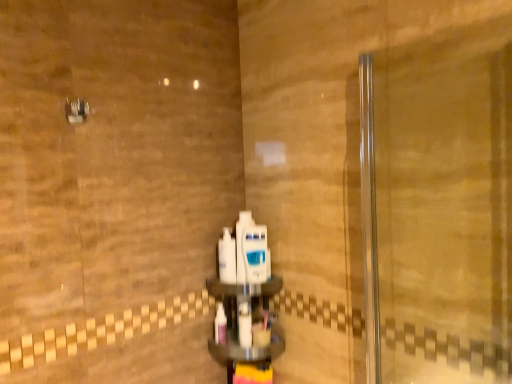
Question: Is white glossy mouthwash at center, arranged as the 3th mouthwash when ordered from the bottom, positioned with its back to white plastic mouthwash at center, which is counted as the 1th mouthwash, starting from the bottom?

Choices:
 (A) yes
 (B) no

Answer: (B)

Question: Considering the relative sizes of white glossy mouthwash at center, positioned as the second mouthwash in top-to-bottom order, and white plastic mouthwash at center, positioned as the 4th mouthwash in top-to-bottom order, in the image provided, is white glossy mouthwash at center, positioned as the second mouthwash in top-to-bottom order, wider than white plastic mouthwash at center, positioned as the 4th mouthwash in top-to-bottom order,?

Choices:
 (A) no
 (B) yes

Answer: (B)

Question: From the image's perspective, is white glossy mouthwash at center, arranged as the 3th mouthwash when ordered from the bottom, located above white plastic mouthwash at center, positioned as the 4th mouthwash in top-to-bottom order?

Choices:
 (A) no
 (B) yes

Answer: (B)

Question: Can you confirm if white glossy mouthwash at center, positioned as the second mouthwash in top-to-bottom order, is shorter than white plastic mouthwash at center, which is counted as the 1th mouthwash, starting from the bottom?

Choices:
 (A) yes
 (B) no

Answer: (B)

Question: Is white glossy mouthwash at center, arranged as the 3th mouthwash when ordered from the bottom, positioned far away from white plastic mouthwash at center, which is counted as the 1th mouthwash, starting from the bottom?

Choices:
 (A) no
 (B) yes

Answer: (A)

Question: In terms of height, does white glossy mouthwash at center, arranged as the 2th mouthwash when ordered from the bottom, look taller or shorter compared to metallic silver showerhead at upper left?

Choices:
 (A) short
 (B) tall

Answer: (B)

Question: Is white glossy mouthwash at center, the third mouthwash in the top-to-bottom sequence, to the left or to the right of metallic silver showerhead at upper left in the image?

Choices:
 (A) right
 (B) left

Answer: (A)

Question: Is white glossy mouthwash at center, the third mouthwash in the top-to-bottom sequence, situated inside metallic silver showerhead at upper left or outside?

Choices:
 (A) outside
 (B) inside

Answer: (A)

Question: Considering their positions, is white glossy mouthwash at center, arranged as the 2th mouthwash when ordered from the bottom, located in front of or behind metallic silver showerhead at upper left?

Choices:
 (A) front
 (B) behind

Answer: (B)

Question: From a real-world perspective, relative to white plastic mouthwash at center, positioned as the 4th mouthwash in top-to-bottom order, is white glossy mouthwash at center, arranged as the 2th mouthwash when ordered from the bottom, vertically above or below?

Choices:
 (A) above
 (B) below

Answer: (A)

Question: Is white glossy mouthwash at center, the third mouthwash in the top-to-bottom sequence, bigger or smaller than white plastic mouthwash at center, which is counted as the 1th mouthwash, starting from the bottom?

Choices:
 (A) big
 (B) small

Answer: (A)

Question: From the image's perspective, is white glossy mouthwash at center, the third mouthwash in the top-to-bottom sequence, above or below white plastic mouthwash at center, which is counted as the 1th mouthwash, starting from the bottom?

Choices:
 (A) below
 (B) above

Answer: (B)

Question: Is white glossy mouthwash at center, arranged as the 2th mouthwash when ordered from the bottom, in front of or behind white plastic mouthwash at center, positioned as the 4th mouthwash in top-to-bottom order, in the image?

Choices:
 (A) behind
 (B) front

Answer: (B)

Question: Is white glossy mouthwash at center, positioned as the second mouthwash in top-to-bottom order, situated inside white glossy mouthwash at center, which is the fourth mouthwash from bottom to top, or outside?

Choices:
 (A) inside
 (B) outside

Answer: (B)

Question: Relative to white glossy mouthwash at center, which is the fourth mouthwash from bottom to top, is white glossy mouthwash at center, positioned as the second mouthwash in top-to-bottom order, in front or behind?

Choices:
 (A) front
 (B) behind

Answer: (A)